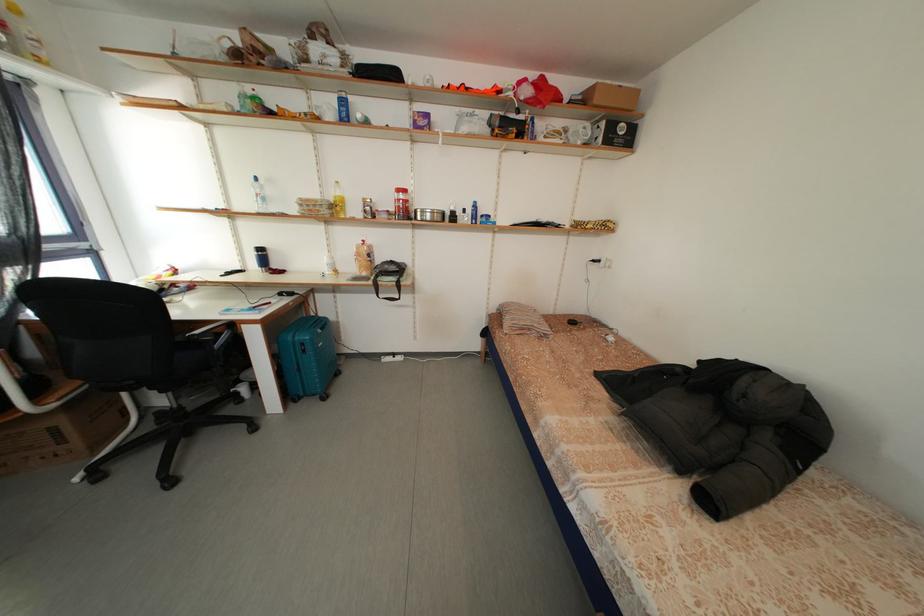
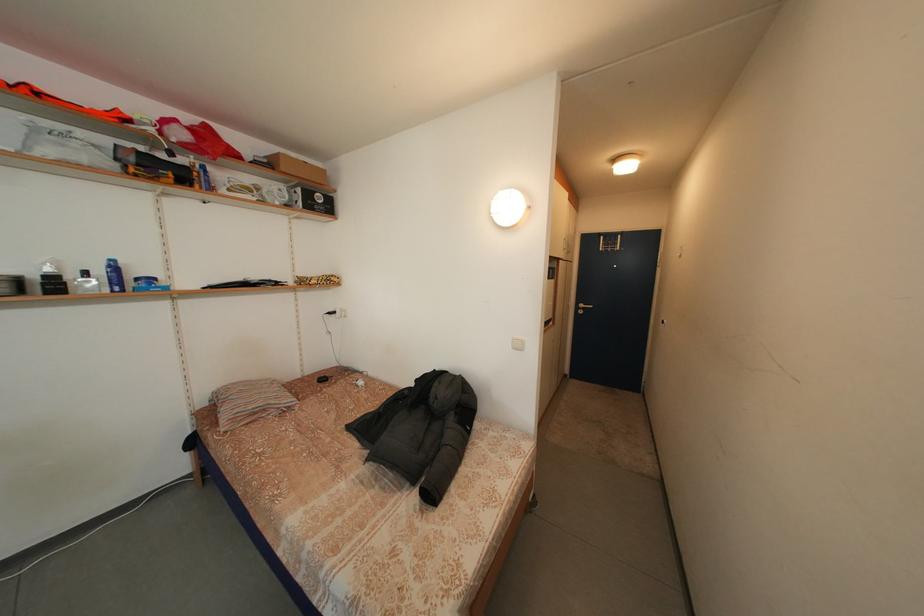
Locate, in the second image, the point that corresponds to point 482,222 in the first image.

(125, 286)